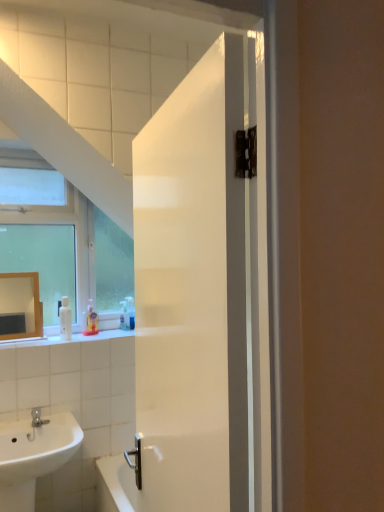
This screenshot has height=512, width=384. What do you see at coordinates (33, 456) in the screenshot? I see `white glossy sink at lower left` at bounding box center [33, 456].

Based on the photo, measure the distance between point (26, 443) and camera.

Point (26, 443) and camera are 1.94 meters apart from each other.

Identify the location of matte gold mirror at upper left. The height and width of the screenshot is (512, 384). (22, 302).

The width and height of the screenshot is (384, 512). What are the coordinates of `translucent plastic soap at lower left, which is the 1th toiletry from back to front` in the screenshot? It's located at (124, 315).

Considering the sizes of objects translucent plastic soap dispenser at lower left, the second toiletry from the right, and white glossy soap dispenser at left in the image provided, who is bigger, translucent plastic soap dispenser at lower left, the second toiletry from the right, or white glossy soap dispenser at left?

white glossy soap dispenser at left.

How different are the orientations of translucent plastic soap dispenser at lower left, the second toiletry from the right, and white glossy soap dispenser at left in degrees?

0.00976 degrees separate the facing orientations of translucent plastic soap dispenser at lower left, the second toiletry from the right, and white glossy soap dispenser at left.

From the image's perspective, is translucent plastic soap dispenser at lower left, the second toiletry from the right, located beneath white glossy soap dispenser at left?

Yes, from the image's perspective, translucent plastic soap dispenser at lower left, the second toiletry from the right, is beneath white glossy soap dispenser at left.

Could you tell me if translucent plastic soap dispenser at lower left, the 2th toiletry when ordered from back to front, is turned towards white glossy soap dispenser at left?

No, translucent plastic soap dispenser at lower left, the 2th toiletry when ordered from back to front, is not facing towards white glossy soap dispenser at left.

In the scene shown: Which of these two, matte gold mirror at upper left or white glossy door at center, is wider?

With larger width is white glossy door at center.

From the image's perspective, who appears lower, matte gold mirror at upper left or white glossy door at center?

matte gold mirror at upper left, from the image's perspective.

Is matte gold mirror at upper left taller or shorter than white glossy door at center?

Clearly, matte gold mirror at upper left is shorter compared to white glossy door at center.

Locate an element on the screen. The height and width of the screenshot is (512, 384). mirror beneath the white glossy door at center (from a real-world perspective) is located at coordinates (22, 302).

Does point (186, 219) come closer to viewer compared to point (34, 329)?

Yes, point (186, 219) is closer to viewer.

From the picture: Is white glossy door at center far away from matte gold mirror at upper left?

Yes.

At what (x,y) coordinates should I click in order to perform the action: click on mirror to the left of white glossy door at center. Please return your answer as a coordinate pair (x, y). Looking at the image, I should click on (22, 302).

Does white glossy door at center appear on the right side of matte gold mirror at upper left?

Yes.

Can you confirm if matte gold mirror at upper left is positioned to the left of white glossy sink at lower left?

Yes, matte gold mirror at upper left is to the left of white glossy sink at lower left.

Where is `sink in front of the matte gold mirror at upper left`? This screenshot has width=384, height=512. sink in front of the matte gold mirror at upper left is located at coordinates (33, 456).

Does matte gold mirror at upper left lie behind white glossy sink at lower left?

Yes, matte gold mirror at upper left is behind white glossy sink at lower left.

Considering the positions of objects white glossy sink at lower left and translucent plastic soap dispenser at lower left, the second toiletry from the right, in the image provided, who is more to the left, white glossy sink at lower left or translucent plastic soap dispenser at lower left, the second toiletry from the right,?

From the viewer's perspective, white glossy sink at lower left appears more on the left side.

From the image's perspective, does white glossy sink at lower left appear lower than translucent plastic soap dispenser at lower left, which is counted as the first toiletry, starting from the front?

Indeed, from the image's perspective, white glossy sink at lower left is shown beneath translucent plastic soap dispenser at lower left, which is counted as the first toiletry, starting from the front.

Between point (66, 450) and point (91, 319), which one is positioned in front?

The point (66, 450) is closer.

Between white glossy sink at lower left and translucent plastic soap dispenser at lower left, the 2th toiletry when ordered from back to front, which one has smaller size?

With smaller size is translucent plastic soap dispenser at lower left, the 2th toiletry when ordered from back to front.

Between translucent plastic soap at lower left, which is the 1th toiletry from back to front, and white glossy door at center, which one appears on the right side from the viewer's perspective?

From the viewer's perspective, white glossy door at center appears more on the right side.

Considering the positions of points (127, 310) and (226, 477), is point (127, 310) farther from camera compared to point (226, 477)?

Yes, point (127, 310) is farther from viewer.

Is translucent plastic soap at lower left, placed as the 2th toiletry when sorted from left to right, directly adjacent to white glossy door at center?

translucent plastic soap at lower left, placed as the 2th toiletry when sorted from left to right, and white glossy door at center are not in contact.

Is translucent plastic soap at lower left, which is the first toiletry from right to left, outside of white glossy door at center?

Yes, translucent plastic soap at lower left, which is the first toiletry from right to left, is located beyond the bounds of white glossy door at center.

Based on the photo, from a real-world perspective, relative to white glossy soap dispenser at left, is translucent plastic soap at lower left, which is the first toiletry from right to left, vertically above or below?

translucent plastic soap at lower left, which is the first toiletry from right to left, is situated lower than white glossy soap dispenser at left in the real world.

Does translucent plastic soap at lower left, which is the 1th toiletry from back to front, have a larger size compared to white glossy soap dispenser at left?

Incorrect, translucent plastic soap at lower left, which is the 1th toiletry from back to front, is not larger than white glossy soap dispenser at left.

Is translucent plastic soap at lower left, which is counted as the 2th toiletry, starting from the front, positioned beyond the bounds of white glossy soap dispenser at left?

translucent plastic soap at lower left, which is counted as the 2th toiletry, starting from the front, is positioned outside white glossy soap dispenser at left.

Is the surface of translucent plastic soap at lower left, which is the 1th toiletry from back to front, in direct contact with white glossy soap dispenser at left?

No, translucent plastic soap at lower left, which is the 1th toiletry from back to front, is not making contact with white glossy soap dispenser at left.

This screenshot has width=384, height=512. Identify the location of toiletry that is the 1st object to the right of the white glossy soap dispenser at left, starting at the anchor. (91, 320).

In order to click on door in front of the matte gold mirror at upper left in this screenshot , I will do `click(192, 293)`.

From the image, which object appears to be farther from translucent plastic soap dispenser at lower left, which is counted as the first toiletry, starting from the front, white glossy sink at lower left or white glossy door at center?

white glossy door at center is further to translucent plastic soap dispenser at lower left, which is counted as the first toiletry, starting from the front.

Based on their spatial positions, is white glossy sink at lower left or white glossy soap dispenser at left closer to white glossy door at center?

white glossy sink at lower left is closer to white glossy door at center.

When comparing their distances from white glossy door at center, does matte gold mirror at upper left or white glossy sink at lower left seem further?

matte gold mirror at upper left is positioned further to the anchor white glossy door at center.

Looking at the image, which one is located further to translucent plastic soap at lower left, which is counted as the 2th toiletry, starting from the front, matte gold mirror at upper left or white glossy door at center?

Among the two, white glossy door at center is located further to translucent plastic soap at lower left, which is counted as the 2th toiletry, starting from the front.

Based on the photo, estimate the real-world distances between objects in this image. Which object is further from white glossy sink at lower left, matte gold mirror at upper left or white glossy soap dispenser at left?

white glossy soap dispenser at left is positioned further to the anchor white glossy sink at lower left.

Considering their positions, is translucent plastic soap at lower left, which is the first toiletry from right to left, positioned further to white glossy soap dispenser at left than matte gold mirror at upper left?

Among the two, translucent plastic soap at lower left, which is the first toiletry from right to left, is located further to white glossy soap dispenser at left.

Considering their positions, is white glossy sink at lower left positioned further to translucent plastic soap dispenser at lower left, which is counted as the first toiletry, starting from the front, than matte gold mirror at upper left?

Based on the image, white glossy sink at lower left appears to be further to translucent plastic soap dispenser at lower left, which is counted as the first toiletry, starting from the front.

Looking at the image, which one is located further to white glossy soap dispenser at left, translucent plastic soap at lower left, which is the 1th toiletry from back to front, or translucent plastic soap dispenser at lower left, which appears as the 1th toiletry when viewed from the left?

translucent plastic soap at lower left, which is the 1th toiletry from back to front.

Find the location of a particular element. toiletry situated between white glossy soap dispenser at left and translucent plastic soap at lower left, which is the first toiletry from right to left, from left to right is located at coordinates (91, 320).

You are a GUI agent. You are given a task and a screenshot of the screen. Output one action in this format:
    pyautogui.click(x=<x>, y=<y>)
    Task: Click on the mirror between white glossy door at center and translucent plastic soap dispenser at lower left, the 2th toiletry when ordered from back to front, in the front-back direction
    The width and height of the screenshot is (384, 512).
    Given the screenshot: What is the action you would take?
    pyautogui.click(x=22, y=302)

The image size is (384, 512). What are the coordinates of `soap dispenser between matte gold mirror at upper left and translucent plastic soap at lower left, which is the 1th toiletry from back to front, from left to right` in the screenshot? It's located at (65, 319).

The image size is (384, 512). In order to click on toiletry positioned between white glossy sink at lower left and translucent plastic soap at lower left, which is the first toiletry from right to left, from near to far in this screenshot , I will do point(91,320).